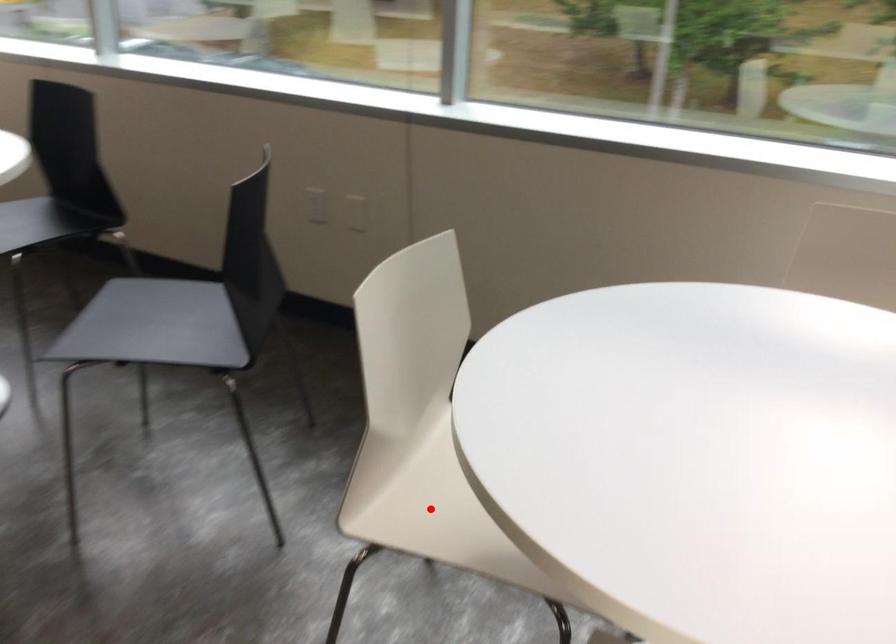
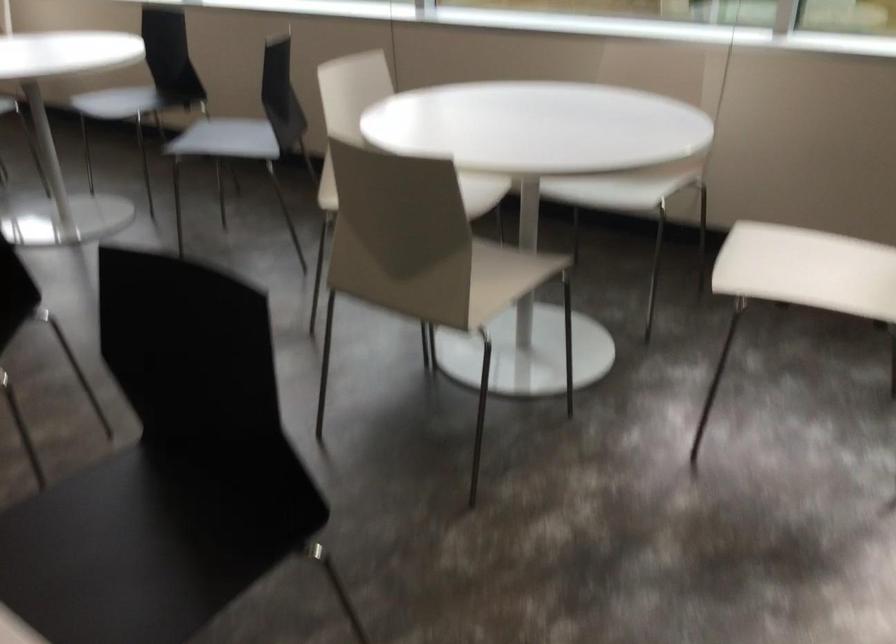
Question: I am providing you with two images of the same scene from different viewpoints. A red point is marked on the first image. Is the red point's position out of view in image 2?

Choices:
 (A) Yes
 (B) No

Answer: (A)